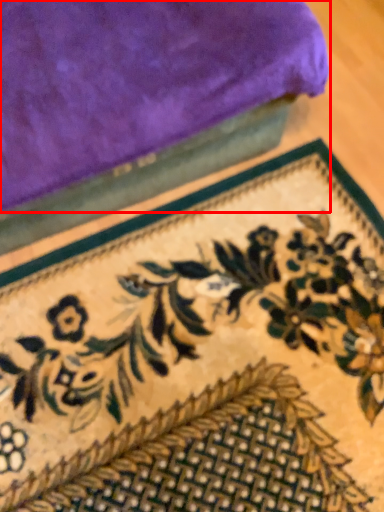
Question: Observing the image, what is the correct spatial positioning of towel (annotated by the red box) in reference to mat?

Choices:
 (A) right
 (B) left

Answer: (B)